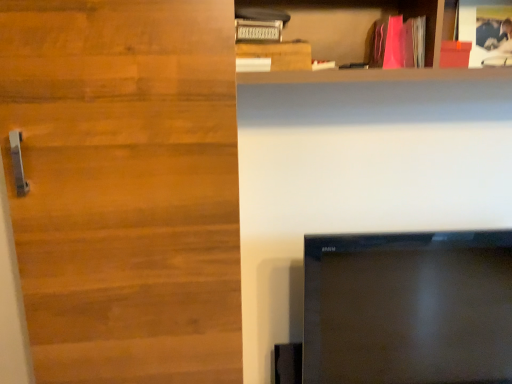
What are the coordinates of `vacant space situated above wooden plank at upper center (from a real-world perspective)` in the screenshot? It's located at (x=275, y=39).